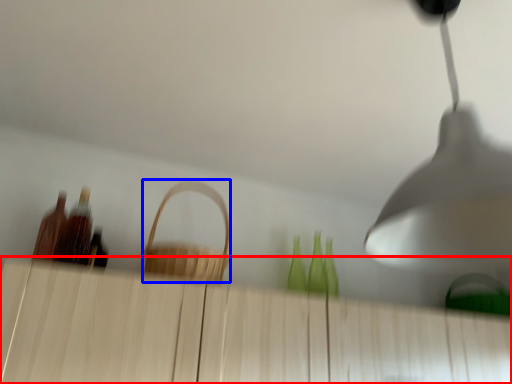
Question: Which object is further to the camera taking this photo, dresser (highlighted by a red box) or basket (highlighted by a blue box)?

Choices:
 (A) dresser
 (B) basket

Answer: (B)